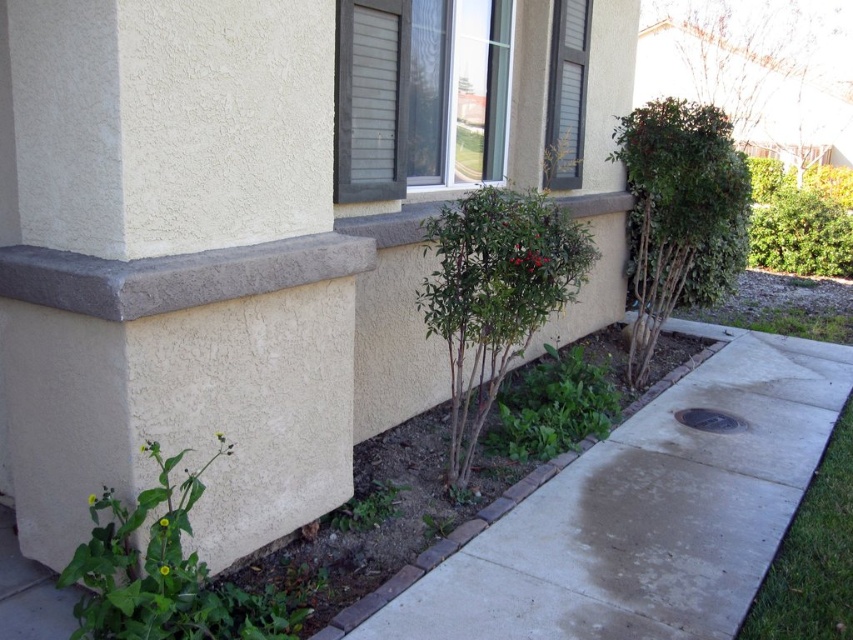
You are standing in front of the residential building and see the green leafy plant at lower left and the green grass at lower right. Which one is positioned more to the left side?

The green leafy plant at lower left is positioned more to the left side than the green grass at lower right.

You are a gardener standing in front of the residential building. You need to water the green leafy plant at lower left and the green grass at lower right. Which one should you water first if you want to start from the lowest point?

The green grass at lower right should be watered first because the green leafy plant at lower left is located above it, meaning the grass is at a lower elevation.

You are standing at the corner of the building where the two walls meet. You want to place a small decorative statue exactly at the center of the landscaped area. The landscaped area is bounded by the wall and the dark gray concrete ledge. Where should you place the statue relative to the green leafy plant at lower left?

The green leafy plant at lower left is located at point (167, 572). To place the statue at the center of the landscaped area, you should position it approximately halfway between the plant and the corner where the walls meet.